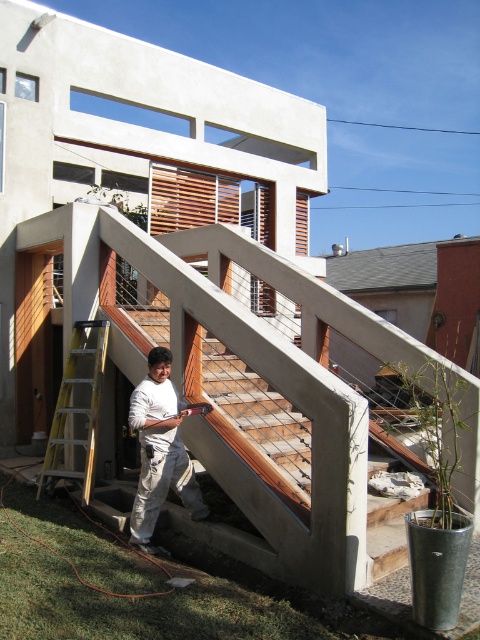
Based on the photo, measure the distance between point (252, 496) and camera.

Point (252, 496) and camera are 5.10 meters apart from each other.

Can you confirm if wooden at center is thinner than white matte shirt at center?

No, wooden at center is not thinner than white matte shirt at center.

Where is `wooden at center`? The height and width of the screenshot is (640, 480). wooden at center is located at coordinates (272, 442).

Is point (348, 502) positioned before point (90, 356)?

Yes, point (348, 502) is in front of point (90, 356).

Identify the location of wooden at center. (272, 442).

Does white matte shirt at center have a larger size compared to yellow/yellowish metallic ladder at lower left?

No, white matte shirt at center is not bigger than yellow/yellowish metallic ladder at lower left.

Is point (156, 369) more distant than point (83, 484)?

No, (156, 369) is in front of (83, 484).

Who is more distant from viewer, (149, 493) or (105, 337)?

The point (105, 337) is behind.

In order to click on white matte shirt at center in this screenshot , I will do `click(160, 451)`.